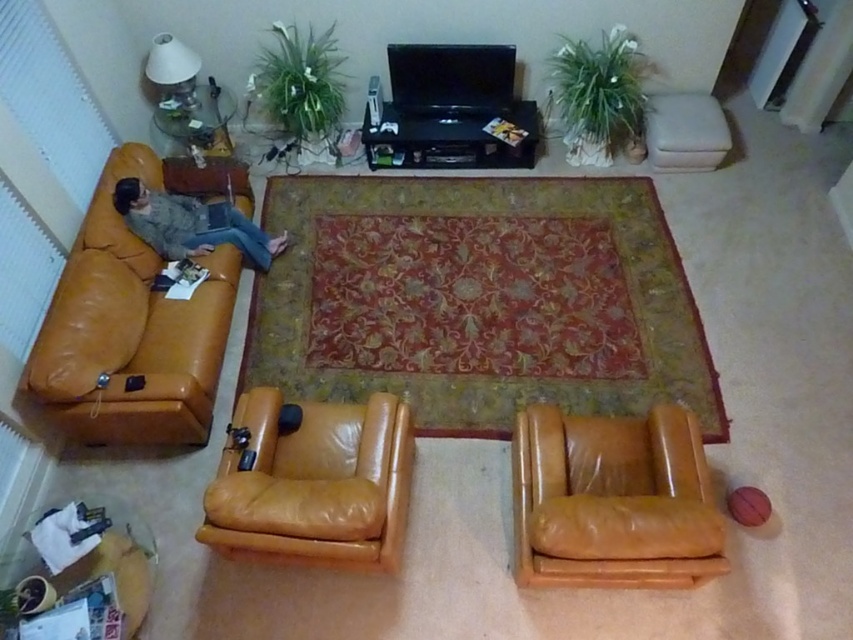
Is matte tan leather armchair at center to the left of matte brown leather couch at left from the viewer's perspective?

No, matte tan leather armchair at center is not to the left of matte brown leather couch at left.

This screenshot has width=853, height=640. In order to click on matte tan leather armchair at center in this screenshot , I will do `click(312, 483)`.

Find the location of `matte tan leather armchair at center`. matte tan leather armchair at center is located at coordinates (312, 483).

Based on the photo, does leather armchair at lower right appear over matte brown leather couch at left?

No.

Which is above, leather armchair at lower right or matte brown leather couch at left?

Positioned higher is matte brown leather couch at left.

Is point (680, 560) farther from camera compared to point (178, 248)?

No, (680, 560) is closer to viewer.

You are a GUI agent. You are given a task and a screenshot of the screen. Output one action in this format:
    pyautogui.click(x=<x>, y=<y>)
    Task: Click on the leather armchair at lower right
    This screenshot has height=640, width=853.
    Given the screenshot: What is the action you would take?
    pyautogui.click(x=612, y=500)

What do you see at coordinates (612, 500) in the screenshot? I see `leather armchair at lower right` at bounding box center [612, 500].

Is leather armchair at lower right wider than matte tan leather armchair at center?

No.

Is point (614, 454) in front of point (238, 516)?

No.

Identify the location of leather armchair at lower right. This screenshot has width=853, height=640. (612, 500).